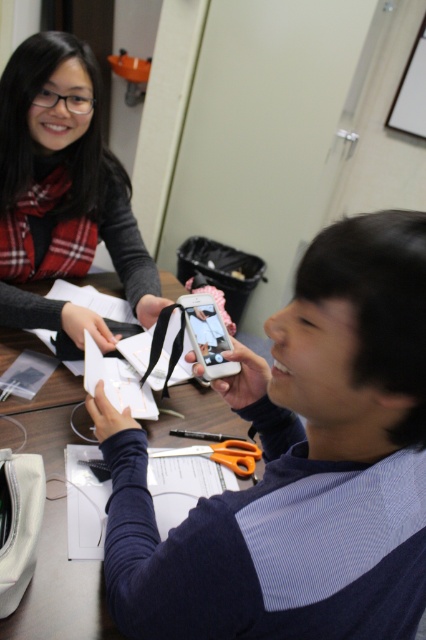
Does plaid fabric scarf at upper left have a smaller size compared to orange plastic scissors at center?

Actually, plaid fabric scarf at upper left might be larger than orange plastic scissors at center.

Is point (51, 182) positioned after point (229, 454)?

Yes, point (51, 182) is farther from viewer.

Does point (104, 211) come in front of point (213, 451)?

No, it is behind (213, 451).

Where is `plaid fabric scarf at upper left`? This screenshot has width=426, height=640. plaid fabric scarf at upper left is located at coordinates (63, 192).